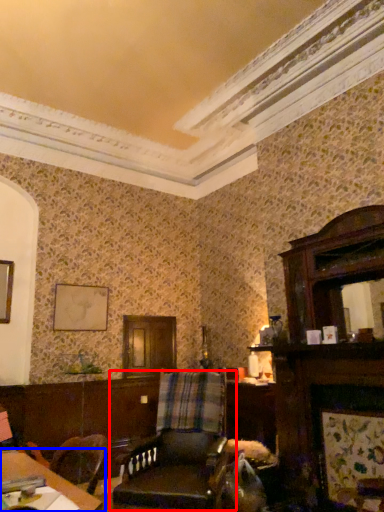
Question: Which of the following is the closest to the observer, chair (highlighted by a red box) or table (highlighted by a blue box)?

Choices:
 (A) chair
 (B) table

Answer: (B)